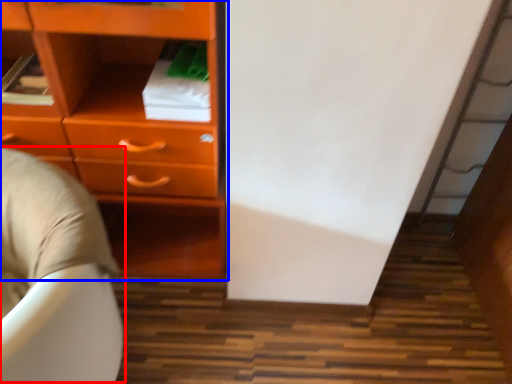
Question: Which object is closer to the camera taking this photo, bean bag chair (highlighted by a red box) or chest of drawers (highlighted by a blue box)?

Choices:
 (A) bean bag chair
 (B) chest of drawers

Answer: (A)